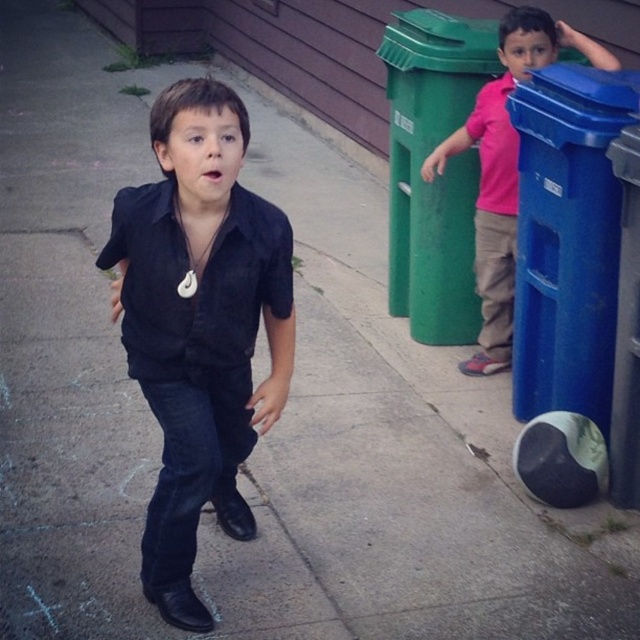
Does brushed metal curb at center appear over pink fabric shirt at right?

Yes.

Is brushed metal curb at center to the left of pink fabric shirt at right from the viewer's perspective?

Correct, you'll find brushed metal curb at center to the left of pink fabric shirt at right.

The image size is (640, 640). Describe the element at coordinates (262, 65) in the screenshot. I see `brushed metal curb at center` at that location.

At what (x,y) coordinates should I click in order to perform the action: click on brushed metal curb at center. Please return your answer as a coordinate pair (x, y). This screenshot has width=640, height=640. Looking at the image, I should click on (262, 65).

In the scene shown: Is pink fabric shirt at right bigger than green plastic curb at upper center?

No.

Is point (490, 364) farther from camera compared to point (220, 60)?

No, (490, 364) is in front of (220, 60).

This screenshot has height=640, width=640. In order to click on pink fabric shirt at right in this screenshot , I will do `click(504, 170)`.

Who is positioned more to the left, blue plastic recycling bin at right or pink fabric shirt at right?

pink fabric shirt at right

Who is more forward, (541, 179) or (486, 321)?

Point (541, 179) is in front.

Locate an element on the screen. The image size is (640, 640). blue plastic recycling bin at right is located at coordinates (566, 237).